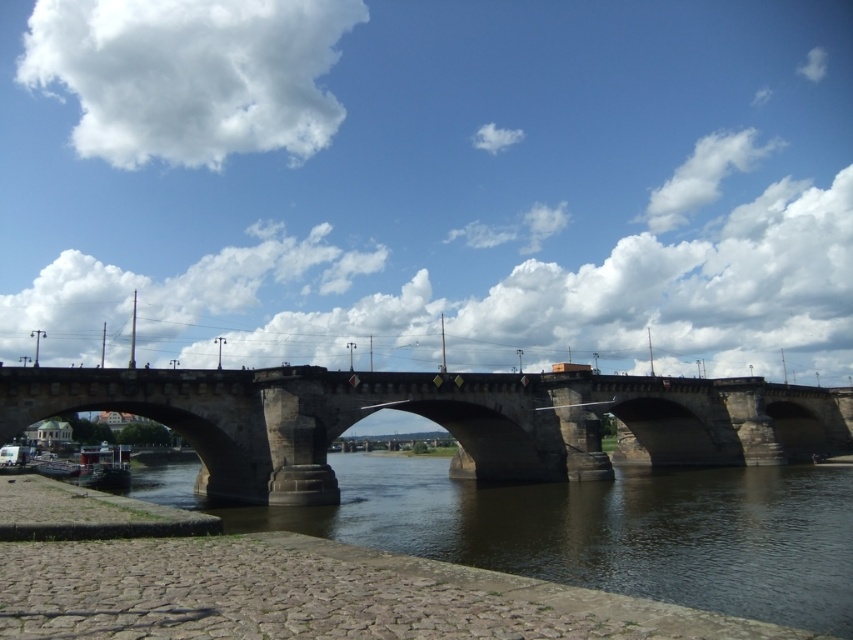
You are a photographer planning to capture the stone bridge at center and the white fluffy cloud at upper center in a single frame. Based on their sizes, which one will appear bigger in the photo?

The stone bridge at center will appear bigger in the photo because it is larger in size than the white fluffy cloud at upper center.

What is the 2D coordinate of the brown stone river at lower left in the image?

The brown stone river at lower left is located at the 2D coordinate point of (x=592, y=529).

You are a photographer standing on the stone bridge at center and want to capture the white fluffy cloud at upper center in your shot. Considering the distance between them, is it possible to take a clear photo of the cloud from your current position?

The distance between the stone bridge at center and the white fluffy cloud at upper center is 334.55 feet. Since clouds are typically high in the sky, this distance is manageable with a standard camera lens, so yes, you can take a clear photo of the white fluffy cloud at upper center from the stone bridge at center.